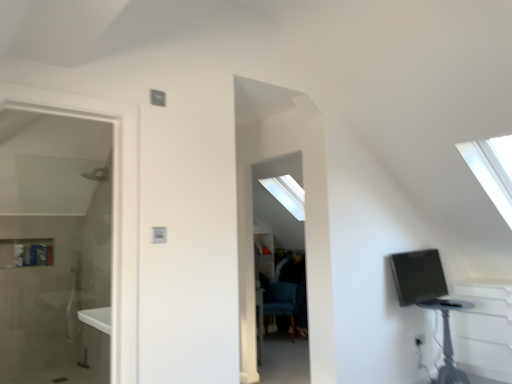
Question: Should I look upward or downward to see blue fabric swivel chair at center?

Choices:
 (A) down
 (B) up

Answer: (A)

Question: Is black plastic table at lower right aimed at matte black monitor at right?

Choices:
 (A) yes
 (B) no

Answer: (B)

Question: From a real-world perspective, is black plastic table at lower right physically below matte black monitor at right?

Choices:
 (A) no
 (B) yes

Answer: (B)

Question: Is matte black monitor at right at the back of black plastic table at lower right?

Choices:
 (A) no
 (B) yes

Answer: (A)

Question: Does black plastic table at lower right appear on the right side of matte black monitor at right?

Choices:
 (A) no
 (B) yes

Answer: (B)

Question: Does black plastic table at lower right have a lesser height compared to matte black monitor at right?

Choices:
 (A) no
 (B) yes

Answer: (A)

Question: From the image's perspective, is black plastic table at lower right over matte black monitor at right?

Choices:
 (A) yes
 (B) no

Answer: (B)

Question: Does black plastic table at lower right have a greater width compared to blue fabric swivel chair at center?

Choices:
 (A) yes
 (B) no

Answer: (A)

Question: Can you confirm if black plastic table at lower right is positioned to the right of blue fabric swivel chair at center?

Choices:
 (A) no
 (B) yes

Answer: (B)

Question: Is black plastic table at lower right closer to camera compared to blue fabric swivel chair at center?

Choices:
 (A) yes
 (B) no

Answer: (A)

Question: Considering the relative positions of black plastic table at lower right and blue fabric swivel chair at center in the image provided, is black plastic table at lower right behind blue fabric swivel chair at center?

Choices:
 (A) yes
 (B) no

Answer: (B)

Question: Is black plastic table at lower right at the left side of blue fabric swivel chair at center?

Choices:
 (A) yes
 (B) no

Answer: (B)

Question: From a real-world perspective, is black plastic table at lower right physically above blue fabric swivel chair at center?

Choices:
 (A) no
 (B) yes

Answer: (B)

Question: Considering the relative sizes of matte black monitor at right and blue fabric swivel chair at center in the image provided, is matte black monitor at right smaller than blue fabric swivel chair at center?

Choices:
 (A) yes
 (B) no

Answer: (A)